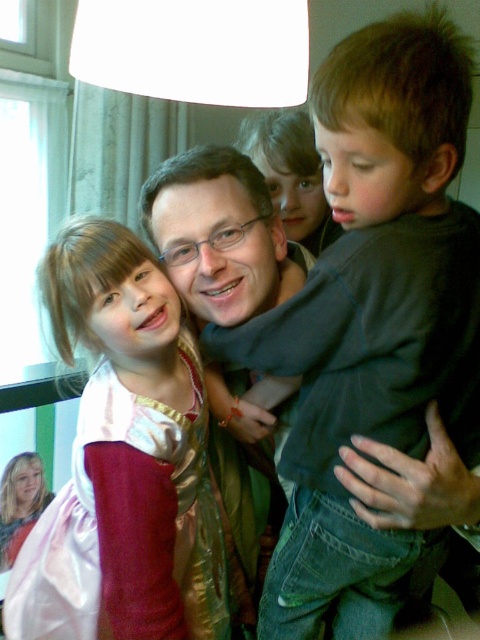
You are a photographer setting up a shoot in this scene. You need to place a small prop between the dark green shirt at center and the pink satin dress at center. Based on their positions, where should you position the prop so it is between them?

The dark green shirt at center is located above the pink satin dress at center, so you should place the prop between them by positioning it below the dark green shirt at center and above the pink satin dress at center.

Based on the photo, you are organizing a clothing donation drive and need to determine which of the two green items, the dark green shirt at center or the matte green sweater at center, can fit into a standard donation box that can only accommodate larger garments. Which item should you choose?

The dark green shirt at center is larger in size than the matte green sweater at center, so you should choose the dark green shirt at center for the donation box that requires larger garments.

You are organizing a photo album and notice two green items in the image. The items are the dark green shirt at center and the matte green sweater at center. Which one is positioned to the right of the other?

The dark green shirt at center is positioned to the right of the matte green sweater at center.